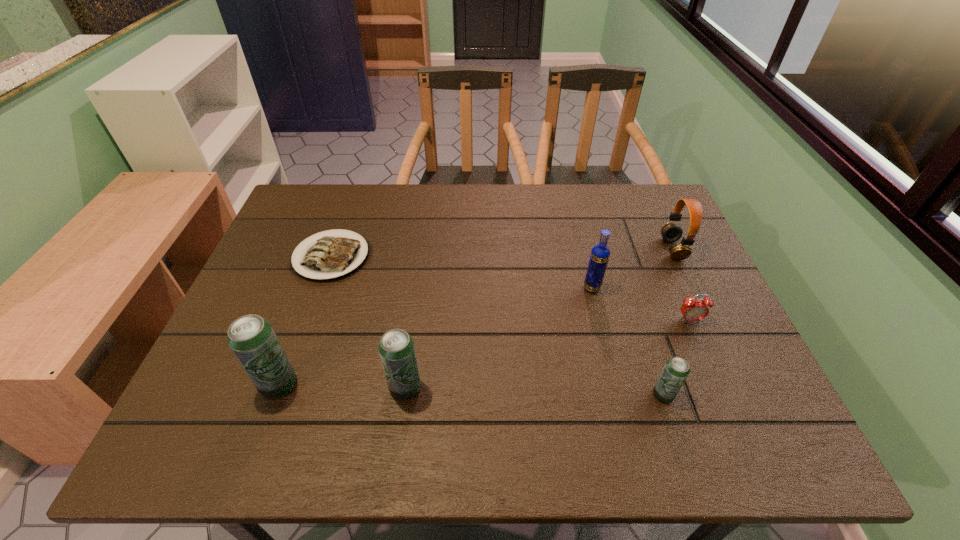
This screenshot has width=960, height=540. Identify the location of vacant region at the far left corner of the desktop. (318, 212).

Where is `free space at the near left corner of the desktop`? This screenshot has width=960, height=540. free space at the near left corner of the desktop is located at coordinates (231, 398).

Find the location of a particular element. The width and height of the screenshot is (960, 540). free location at the far right corner is located at coordinates (633, 216).

The height and width of the screenshot is (540, 960). What are the coordinates of `vacant area that lies between the shortest object and the third object from left to right` in the screenshot? It's located at (369, 322).

This screenshot has height=540, width=960. I want to click on unoccupied area between the second beer can from left to right and the leftmost beer can, so click(x=342, y=386).

Where is `empty space that is in between the second beer can from right to left and the shortest object`? The height and width of the screenshot is (540, 960). empty space that is in between the second beer can from right to left and the shortest object is located at coordinates (369, 322).

Locate an element on the screen. Image resolution: width=960 pixels, height=540 pixels. free space between the headset and the alarm clock is located at coordinates (681, 285).

The image size is (960, 540). What are the coordinates of `free space that is in between the fourth nearest object and the headset` in the screenshot? It's located at (681, 285).

Locate an element on the screen. This screenshot has height=540, width=960. free area in between the second shortest beer can and the third shortest object is located at coordinates (534, 391).

In order to click on free spot between the shortest beer can and the headset in this screenshot , I will do `click(668, 322)`.